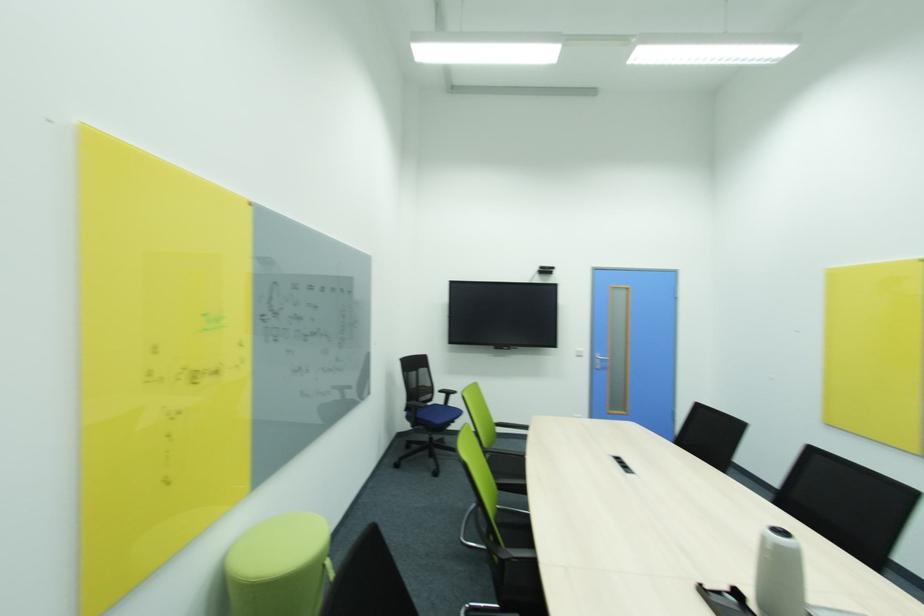
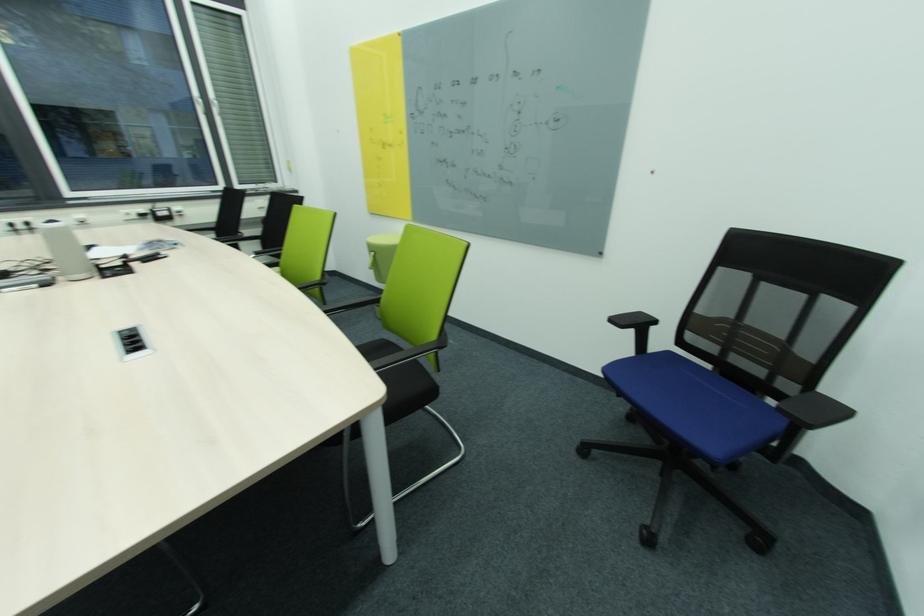
Find the pixel in the second image that matches point (636, 471) in the first image.

(126, 338)